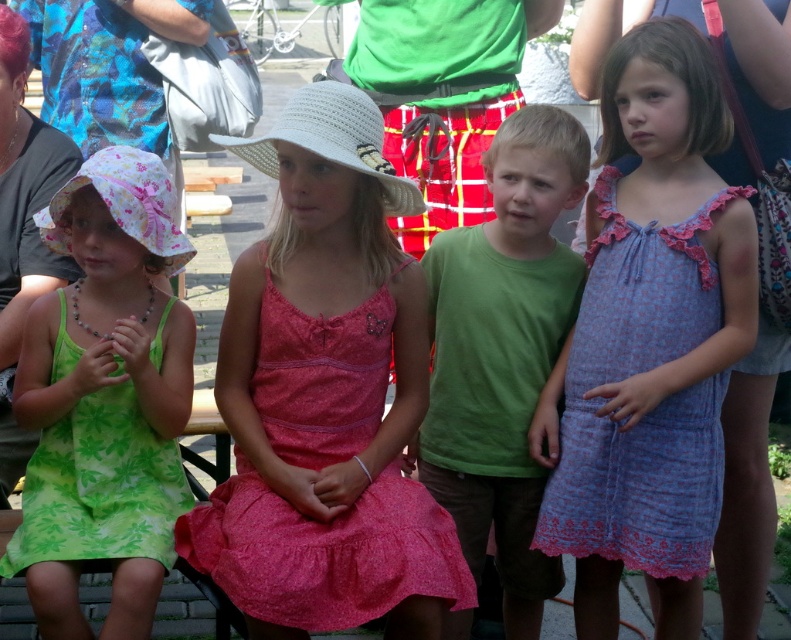
Question: Observing the image, what is the correct spatial positioning of green cotton shirt at center in reference to green floral fabric dress at left?

Choices:
 (A) right
 (B) left

Answer: (A)

Question: Is blue floral fabric dress at right bigger than green floral fabric dress at left?

Choices:
 (A) no
 (B) yes

Answer: (B)

Question: Which of the following is the farthest from the observer?

Choices:
 (A) blue floral fabric dress at right
 (B) pink satin dress at center

Answer: (A)

Question: Among these objects, which one is farthest from the camera?

Choices:
 (A) blue floral fabric dress at right
 (B) green cotton shirt at center

Answer: (B)

Question: Which point is closer to the camera?

Choices:
 (A) blue floral fabric dress at right
 (B) pink satin dress at center

Answer: (B)

Question: Does pink satin dress at center lie in front of blue floral fabric dress at right?

Choices:
 (A) no
 (B) yes

Answer: (B)